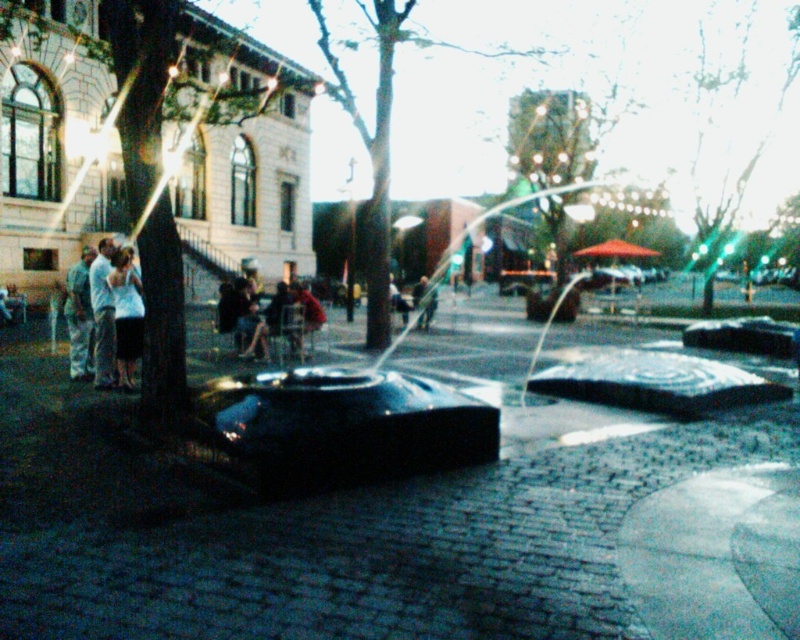
Question: Which point is farther from the camera taking this photo?

Choices:
 (A) (110, 387)
 (B) (88, 272)
 (C) (492, 456)

Answer: (B)

Question: Which point appears farthest from the camera in this image?

Choices:
 (A) (102, 244)
 (B) (84, 310)
 (C) (102, 358)
 (D) (126, 387)

Answer: (B)

Question: Is black polished water feature at center to the right of light blue denim jeans at left from the viewer's perspective?

Choices:
 (A) no
 (B) yes

Answer: (B)

Question: Can you confirm if light blue denim jeans at left is positioned below camouflage pants at left?

Choices:
 (A) yes
 (B) no

Answer: (A)

Question: Among these objects, which one is farthest from the camera?

Choices:
 (A) white cotton shirt at left
 (B) dark fabric jacket at center
 (C) light blue denim jeans at left

Answer: (B)

Question: From the image, what is the correct spatial relationship of black polished water feature at center in relation to white cotton shirt at left?

Choices:
 (A) right
 (B) left

Answer: (A)